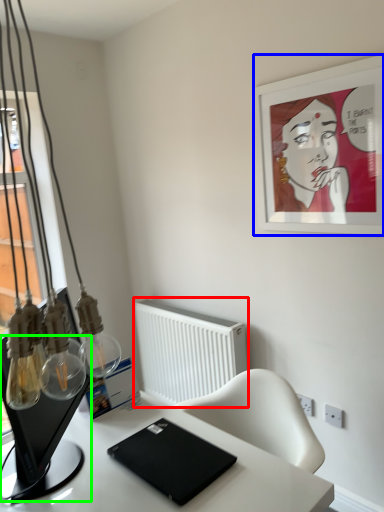
Question: Considering the real-world distances, which object is closest to radiator (highlighted by a red box)? picture frame (highlighted by a blue box) or computer monitor (highlighted by a green box).

Choices:
 (A) picture frame
 (B) computer monitor

Answer: (A)